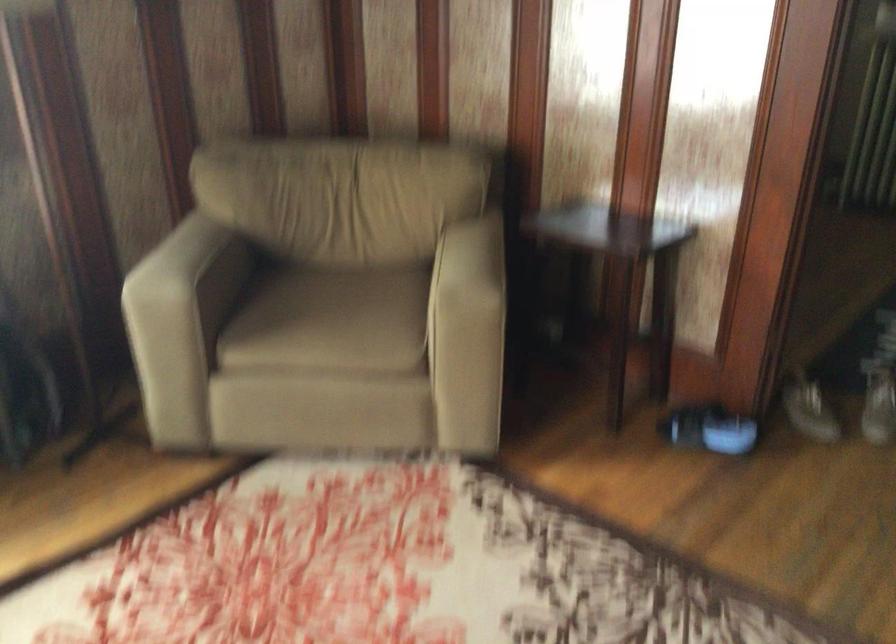
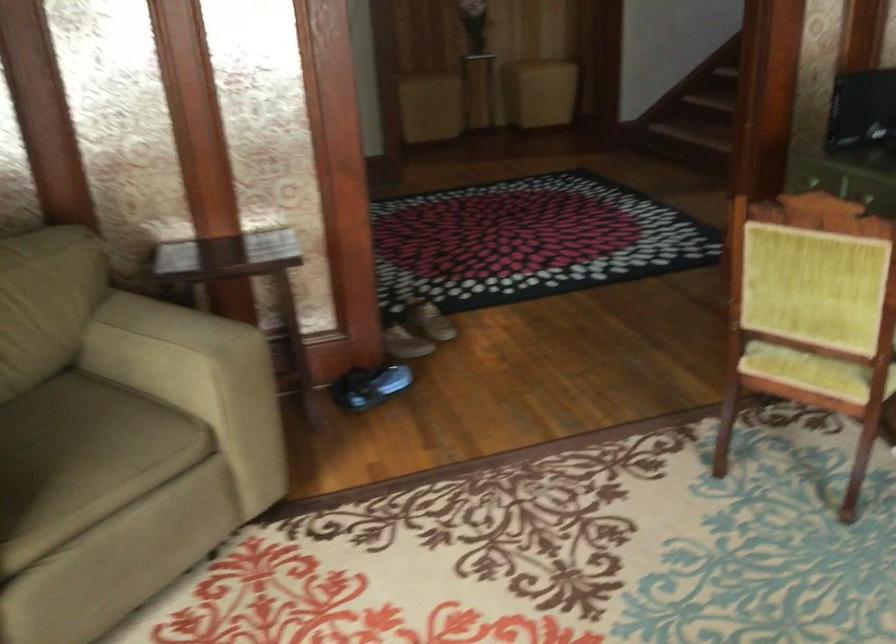
The point at (325, 327) is marked in the first image. Where is the corresponding point in the second image?

(82, 459)